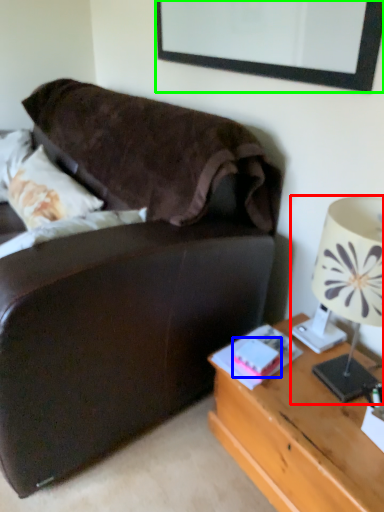
Question: Which object is the farthest from lamp (highlighted by a red box)? Choose among these: book (highlighted by a blue box) or picture frame (highlighted by a green box).

Choices:
 (A) book
 (B) picture frame

Answer: (B)